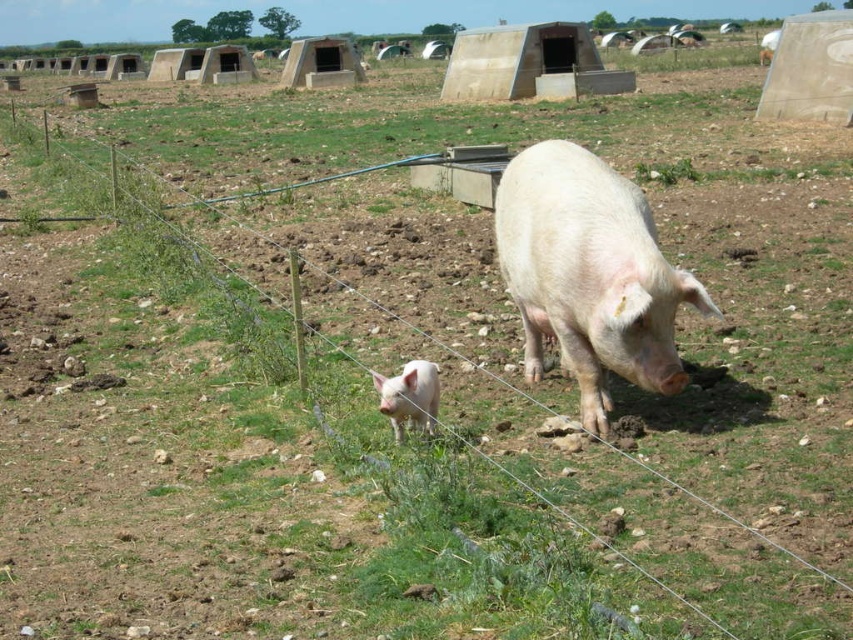
You are a farmer checking the pigs in the field. You see the pink smooth pig at center and the white matte piglet at lower center. Which pig is more to the right?

The pink smooth pig at center is positioned on the right side of white matte piglet at lower center, so the pink smooth pig at center is more to the right.

You are a farmer checking the pigs in the field. You see the pink smooth pig at center and the white matte piglet at lower center. Which pig is nearer to you?

The pink smooth pig at center is closer to the viewer than the white matte piglet at lower center, so the pink smooth pig at center is nearer to you.